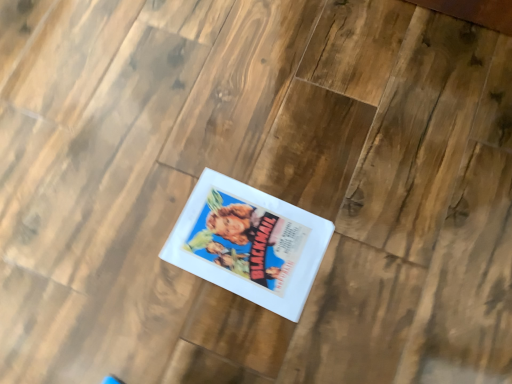
This screenshot has height=384, width=512. In order to click on vacant area on the back side of white glossy paperback book at center in this screenshot , I will do `click(259, 138)`.